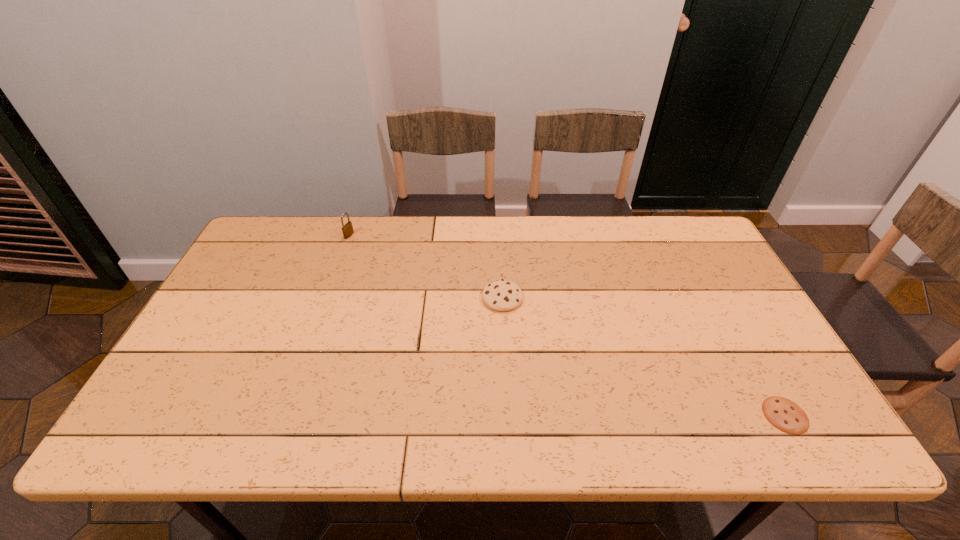
Identify the location of vacant space that's between the padlock and the farther cookie. The image size is (960, 540). (425, 267).

Find the location of `free space between the nearest object and the left cookie`. free space between the nearest object and the left cookie is located at coordinates (643, 356).

At what (x,y) coordinates should I click in order to perform the action: click on empty space that is in between the shortest object and the tallest object. Please return your answer as a coordinate pair (x, y). This screenshot has height=540, width=960. Looking at the image, I should click on (567, 325).

The width and height of the screenshot is (960, 540). I want to click on free space between the second shortest object and the tallest object, so click(425, 267).

The height and width of the screenshot is (540, 960). I want to click on free space between the taller cookie and the right cookie, so click(643, 356).

Find the location of `vacant area that lies between the farthest object and the nearer cookie`. vacant area that lies between the farthest object and the nearer cookie is located at coordinates (567, 325).

Where is `free space between the padlock and the nearest object`? This screenshot has width=960, height=540. free space between the padlock and the nearest object is located at coordinates click(567, 325).

This screenshot has width=960, height=540. Find the location of `free space between the second nearest object and the farthest object`. free space between the second nearest object and the farthest object is located at coordinates (425, 267).

This screenshot has height=540, width=960. What are the coordinates of `vacant point located between the second farthest object and the padlock` in the screenshot? It's located at (425, 267).

Locate an element on the screen. object that is the closest to the nearer cookie is located at coordinates (502, 295).